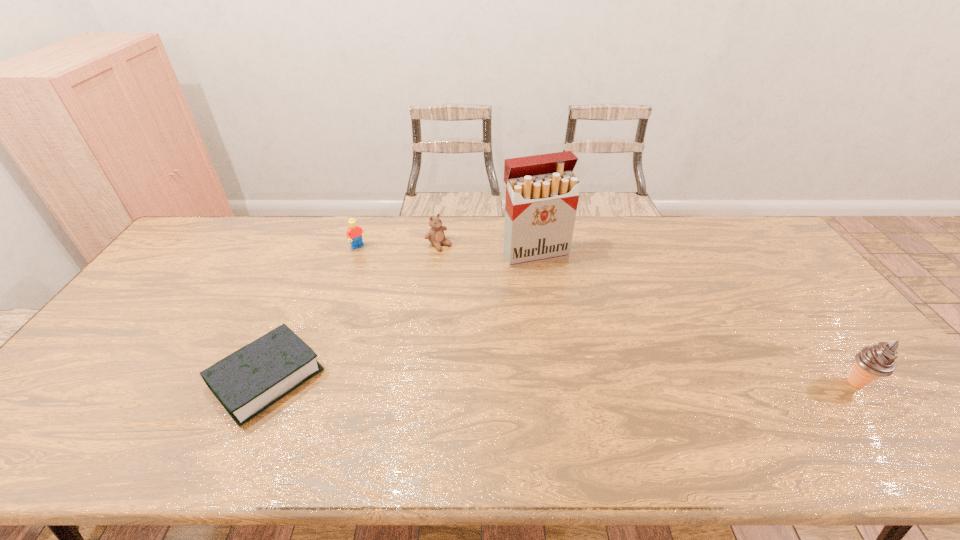
Identify the location of Bible. (248, 381).

Identify the location of the second tallest object. (875, 361).

This screenshot has width=960, height=540. In order to click on icecream in this screenshot , I will do `click(875, 361)`.

You are a GUI agent. You are given a task and a screenshot of the screen. Output one action in this format:
    pyautogui.click(x=<x>, y=<y>)
    Task: Click on the teddy bear
    
    Given the screenshot: What is the action you would take?
    pyautogui.click(x=435, y=235)

The image size is (960, 540). In order to click on cigarette case in this screenshot , I will do `click(542, 193)`.

The width and height of the screenshot is (960, 540). What are the coordinates of `the fourth object from left to right` in the screenshot? It's located at (542, 193).

You are a GUI agent. You are given a task and a screenshot of the screen. Output one action in this format:
    pyautogui.click(x=<x>, y=<y>)
    Task: Click on the Lego
    
    Given the screenshot: What is the action you would take?
    pyautogui.click(x=354, y=233)

This screenshot has width=960, height=540. In order to click on vacant space located on the left of the Bible in this screenshot , I will do `click(180, 378)`.

The image size is (960, 540). In order to click on blank area located 0.230m on the back of the icecream in this screenshot , I will do `click(798, 308)`.

Where is `free space located on the front-facing side of the teddy bear`? This screenshot has width=960, height=540. free space located on the front-facing side of the teddy bear is located at coordinates (460, 260).